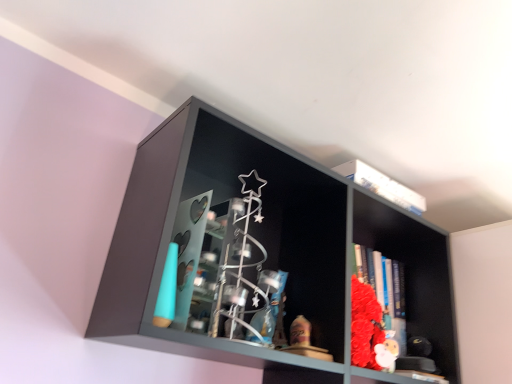
This screenshot has height=384, width=512. What do you see at coordinates (387, 354) in the screenshot? I see `white plush toy at lower right` at bounding box center [387, 354].

In order to face white plush toy at lower right, should I rotate leftwards or rightwards?

It's best to rotate right around 17.165 degrees.

In order to click on white plush toy at lower right in this screenshot , I will do `click(387, 354)`.

The height and width of the screenshot is (384, 512). Describe the element at coordinates (263, 257) in the screenshot. I see `matte black shelf at center` at that location.

Locate an element on the screen. The image size is (512, 384). matte black shelf at center is located at coordinates (263, 257).

The width and height of the screenshot is (512, 384). I want to click on white plush toy at lower right, so click(x=387, y=354).

Does matte black shelf at center appear on the left side of white plush toy at lower right?

Yes, matte black shelf at center is to the left of white plush toy at lower right.

Which object is closer to the camera taking this photo, matte black shelf at center or white plush toy at lower right?

matte black shelf at center is closer to the camera.

Considering the points (365, 287) and (386, 365), which point is in front, point (365, 287) or point (386, 365)?

The point (386, 365) is more forward.

From the image's perspective, is matte black shelf at center on top of white plush toy at lower right?

Correct, matte black shelf at center appears higher than white plush toy at lower right in the image.

From a real-world perspective, is matte black shelf at center over white plush toy at lower right?

Yes, from a real-world perspective, matte black shelf at center is on top of white plush toy at lower right.

Considering the sizes of matte black shelf at center and white plush toy at lower right in the image, is matte black shelf at center wider or thinner than white plush toy at lower right?

Considering their sizes, matte black shelf at center looks broader than white plush toy at lower right.

Who is shorter, matte black shelf at center or white plush toy at lower right?

With less height is white plush toy at lower right.

Based on their sizes in the image, would you say matte black shelf at center is bigger or smaller than white plush toy at lower right?

Clearly, matte black shelf at center is larger in size than white plush toy at lower right.

Is matte black shelf at center outside of white plush toy at lower right?

Yes.

Is there a large distance between matte black shelf at center and white plush toy at lower right?

No, matte black shelf at center is not far from white plush toy at lower right.

Consider the image. Is matte black shelf at center aimed at white plush toy at lower right?

Yes, matte black shelf at center is aimed at white plush toy at lower right.

The image size is (512, 384). What are the coordinates of `shelf in front of the white plush toy at lower right` in the screenshot? It's located at click(263, 257).

Is white plush toy at lower right at the right side of matte black shelf at center?

Indeed, white plush toy at lower right is positioned on the right side of matte black shelf at center.

Which object is further away from the camera taking this photo, white plush toy at lower right or matte black shelf at center?

Positioned behind is white plush toy at lower right.

Is point (376, 344) in front of point (143, 252)?

No.

Based on the photo, from the image's perspective, who appears lower, white plush toy at lower right or matte black shelf at center?

white plush toy at lower right is shown below in the image.

In the scene shown: From a real-world perspective, relative to matte black shelf at center, is white plush toy at lower right vertically above or below?

Clearly, from a real-world perspective, white plush toy at lower right is below matte black shelf at center.

Considering the sizes of objects white plush toy at lower right and matte black shelf at center in the image provided, who is thinner, white plush toy at lower right or matte black shelf at center?

white plush toy at lower right.

Considering the sizes of white plush toy at lower right and matte black shelf at center in the image, is white plush toy at lower right taller or shorter than matte black shelf at center?

Considering their sizes, white plush toy at lower right has less height than matte black shelf at center.

From the picture: Between white plush toy at lower right and matte black shelf at center, which one has larger size?

matte black shelf at center is bigger.

Would you say white plush toy at lower right is outside matte black shelf at center?

No.

Is white plush toy at lower right directly adjacent to matte black shelf at center?

No, white plush toy at lower right is not touching matte black shelf at center.

Is white plush toy at lower right aimed at matte black shelf at center?

Yes, white plush toy at lower right is turned towards matte black shelf at center.

Find the location of a particular element. toy located below the matte black shelf at center (from the image's perspective) is located at coordinates (387, 354).

Identify the location of shelf on the left of white plush toy at lower right. (263, 257).

The width and height of the screenshot is (512, 384). I want to click on toy behind the matte black shelf at center, so click(387, 354).